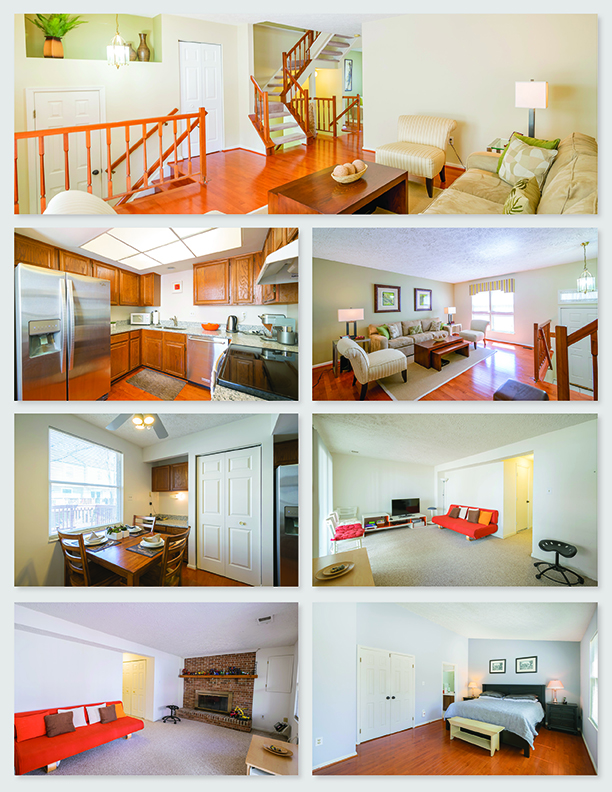
Where is `framed wall art`? This screenshot has width=612, height=792. framed wall art is located at coordinates click(x=389, y=299), click(x=419, y=297), click(x=494, y=661), click(x=518, y=661), click(x=346, y=77).